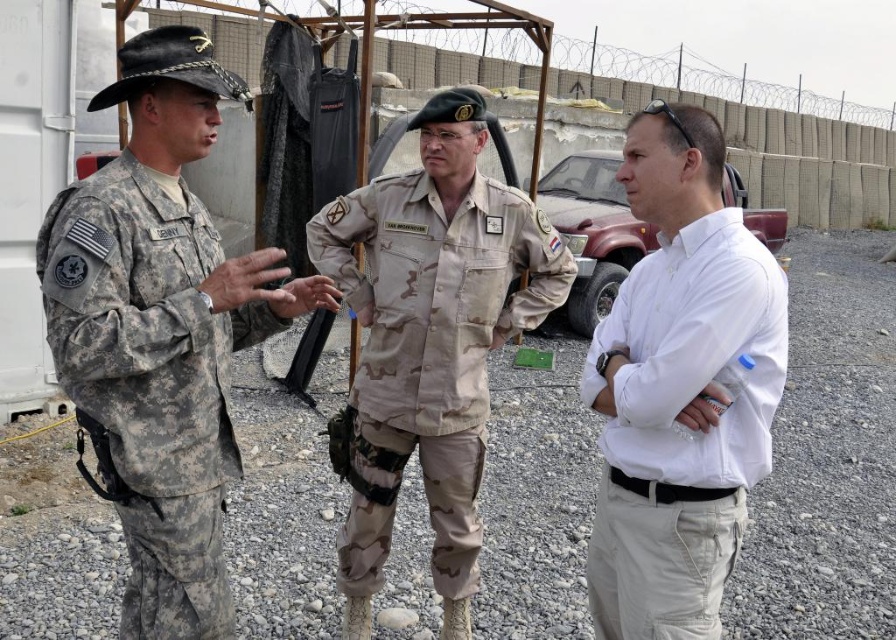
You are standing at the barbed wire fence and want to move towards the two points marked in the image. Which point, point (118, 193) or point (464, 461), is closer to you?

Point (118, 193) is closer to the viewer than point (464, 461), so the closer point is point (118, 193).

You are a photographer trying to capture a group photo of the white cotton shirt at right and the camouflage fabric uniform at left. If you want to ensure both subjects are in focus, which one should you position closer to the camera to maintain depth of field?

The white cotton shirt at right is thinner than the camouflage fabric uniform at left. To maintain depth of field, position the thinner subject closer to the camera. Therefore, place the white cotton shirt at right closer to the camera.

Looking at this image, you are a drone operator controlling a surveillance drone that has a minimum safe distance requirement of 36 inches between the drone and any individuals to avoid detection. You need to fly the drone between the camouflage fabric uniform at left and the camouflage fabric uniform at center. Based on the scene, can the drone safely pass between them without coming closer than 36 inches to either individual?

The distance between the camouflage fabric uniform at left and the camouflage fabric uniform at center is 35.49 inches, which is less than the minimum safe distance of 36 inches required by the drone. Therefore, the drone cannot safely pass between them without risking detection.